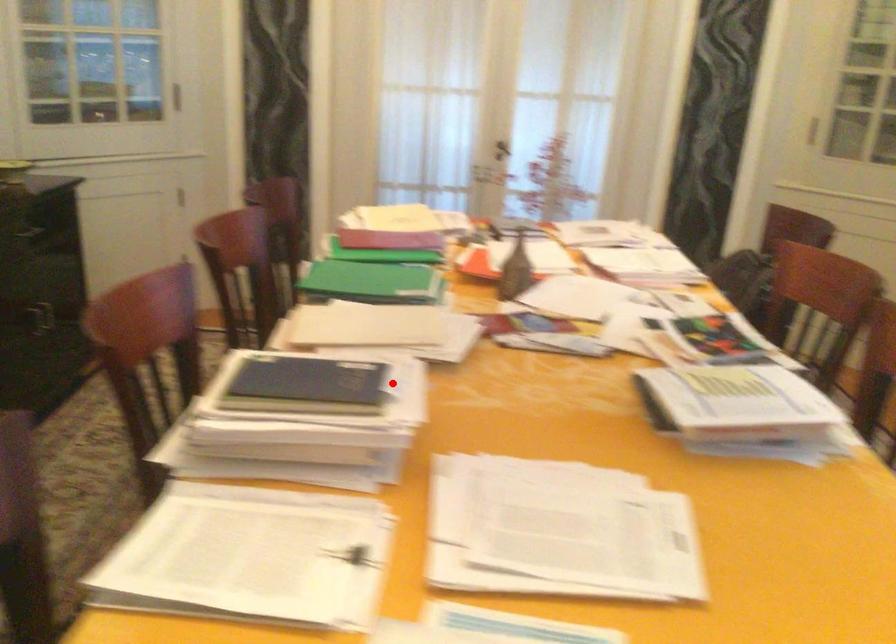
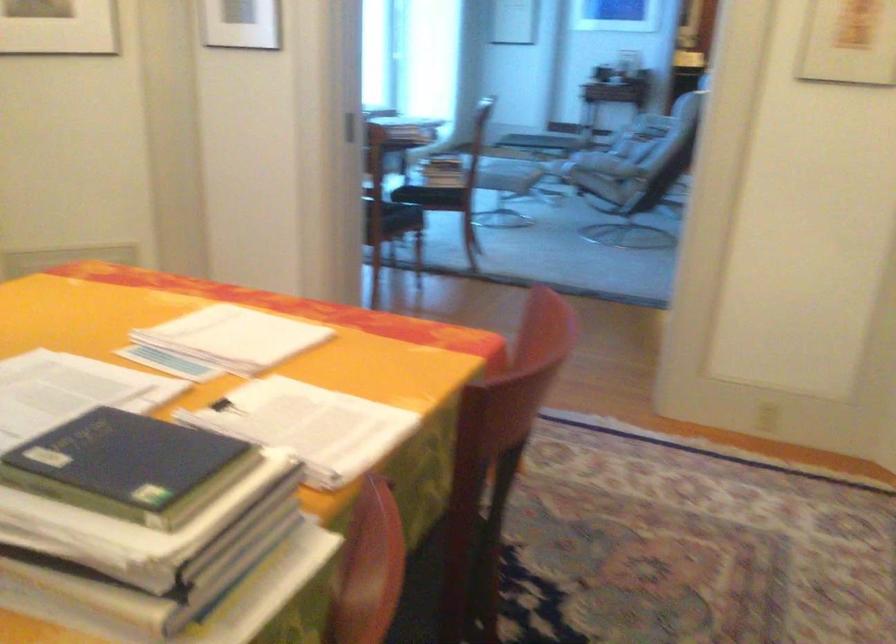
Question: I am providing you with two images of the same scene from different viewpoints. In image1, a red point is highlighted. Considering the same 3D point in image2, which of the following is correct?

Choices:
 (A) It is closer
 (B) It is farther

Answer: (A)